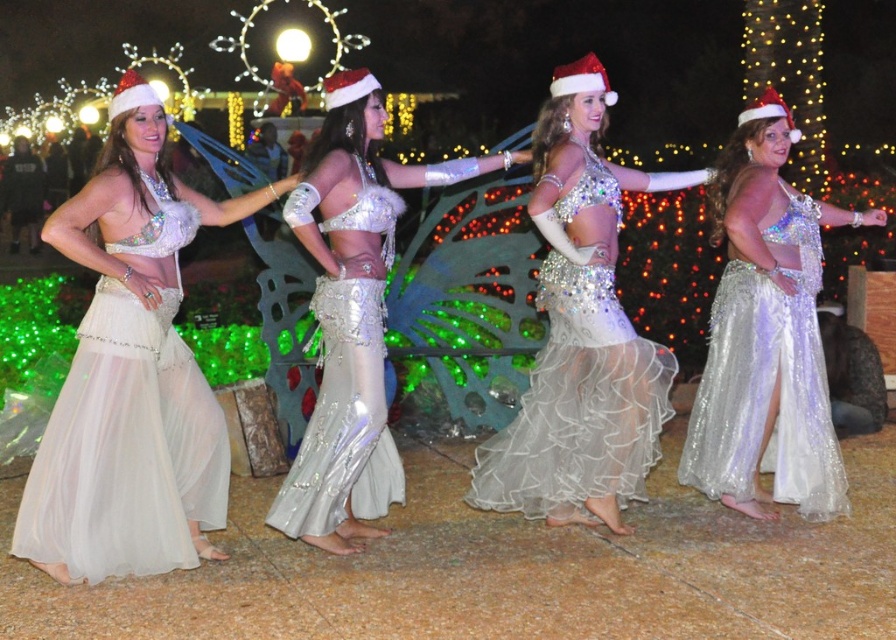
You are a photographer trying to capture the festive scene. You want to take a photo that includes both the matte silver belly dancer at left and the shiny silver belly dancer at center. Which dancer should you focus on first to ensure both are in frame?

The matte silver belly dancer at left is located below the shiny silver belly dancer at center, so focusing on the shiny silver belly dancer at center first will ensure the matte silver belly dancer at left is also within the frame since it is positioned lower down.

You are a photographer at the event and want to capture a photo that includes both the shiny silver belly dancer at center and the shimmering sequined skirt at center. Based on their positions, which object should be placed to the left in the photo?

The shiny silver belly dancer at center is positioned on the left side of the shimmering sequined skirt at center, so in the photo, the shiny silver belly dancer at center should be placed to the left of the shimmering sequined skirt at center.